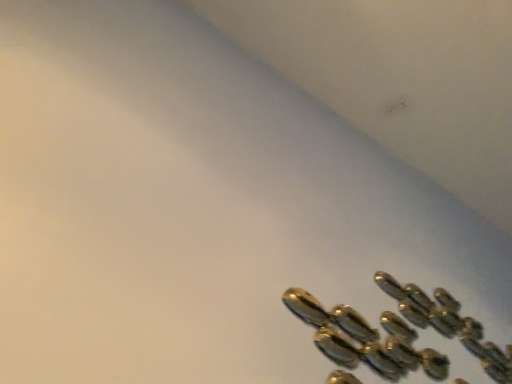
What is the approximate height of metallic gold coin at bottom right?

It is 23.17 inches.

Image resolution: width=512 pixels, height=384 pixels. What do you see at coordinates (365, 339) in the screenshot?
I see `metallic gold coin at bottom right` at bounding box center [365, 339].

You are a GUI agent. You are given a task and a screenshot of the screen. Output one action in this format:
    pyautogui.click(x=<x>, y=<y>)
    Task: Click on the metallic gold coin at bottom right
    
    Given the screenshot: What is the action you would take?
    pyautogui.click(x=365, y=339)

At what (x,y) coordinates should I click in order to perform the action: click on metallic gold coin at bottom right. Please return your answer as a coordinate pair (x, y). This screenshot has height=384, width=512. Looking at the image, I should click on (365, 339).